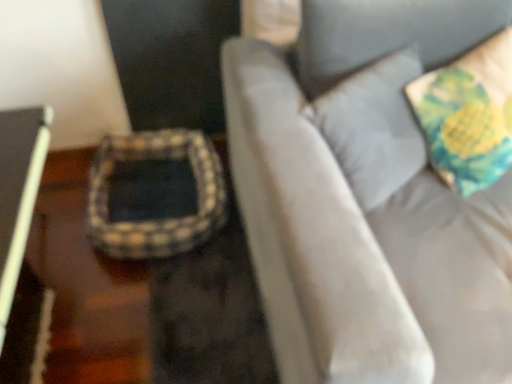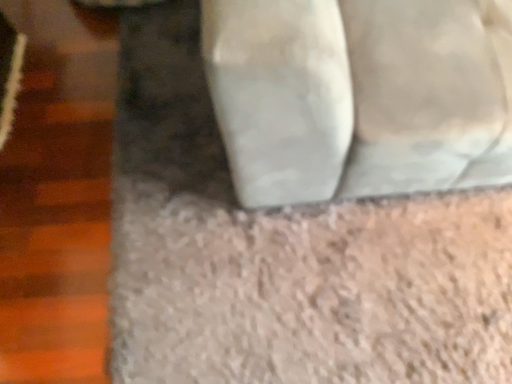
Question: Which way did the camera rotate in the video?

Choices:
 (A) rotated downward
 (B) rotated upward

Answer: (A)